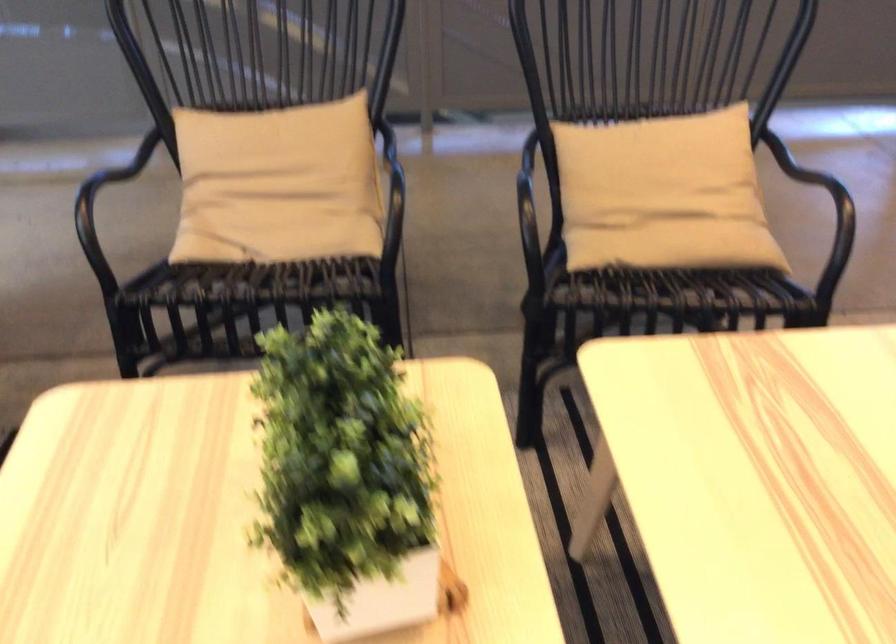
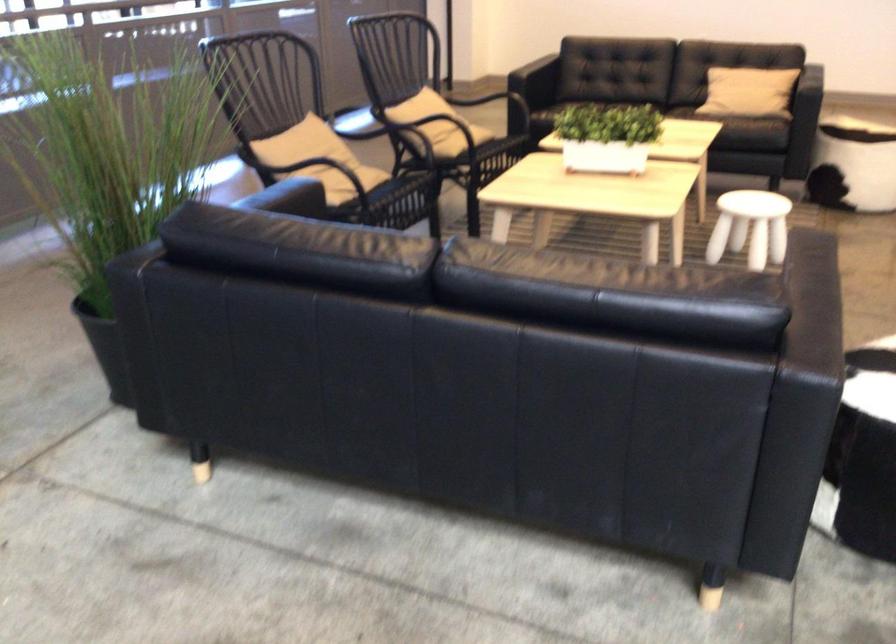
Locate, in the second image, the point that corresponds to point 602,249 in the first image.

(462, 140)